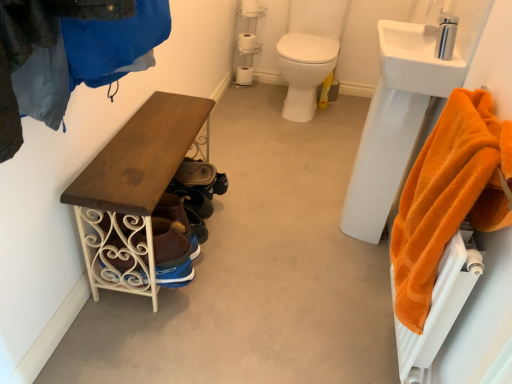
Find the location of a particular element. empty space that is ontop of white plastic shelf at center (from a real-world perspective) is located at coordinates (250, 8).